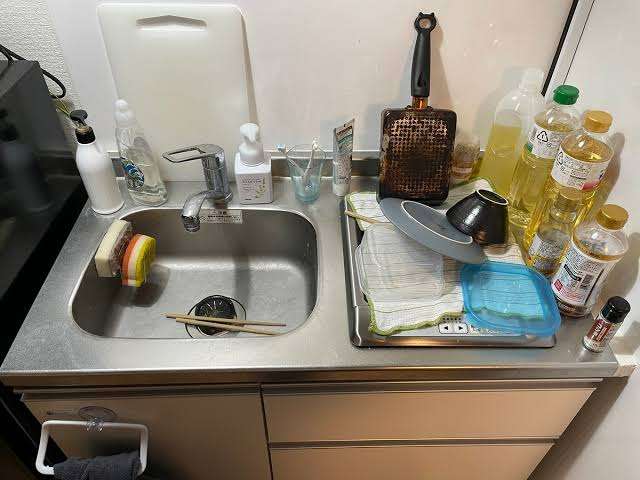
Find the location of `tap`. tap is located at coordinates (192, 207).